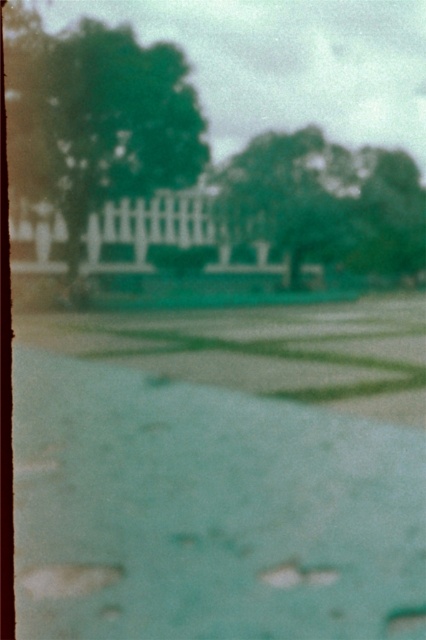
Looking at this image, does green grass at center appear on the right side of green leafy tree at upper left?

Indeed, green grass at center is positioned on the right side of green leafy tree at upper left.

Does green grass at center have a lesser height compared to green leafy tree at upper left?

Yes, green grass at center is shorter than green leafy tree at upper left.

Is point (229, 538) positioned before point (172, 54)?

Yes, it is in front of point (172, 54).

Where is `green grass at center`? green grass at center is located at coordinates (221, 474).

Which is more to the left, green leafy tree at upper left or green leafy tree at upper center?

green leafy tree at upper left is more to the left.

Is point (152, 60) closer to viewer compared to point (371, 221)?

Yes, it is in front of point (371, 221).

This screenshot has height=640, width=426. Find the location of `green leafy tree at upper left`. green leafy tree at upper left is located at coordinates (95, 120).

Between green grass at center and green leafy tree at upper center, which one appears on the left side from the viewer's perspective?

green grass at center

Which is behind, point (94, 595) or point (397, 164)?

Point (397, 164)

The width and height of the screenshot is (426, 640). Identify the location of green grass at center. (221, 474).